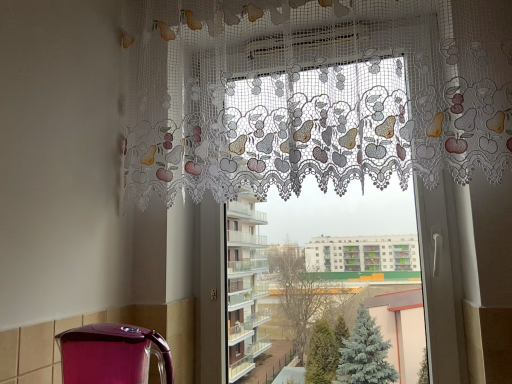
Question: Is point (100, 326) closer or farther from the camera than point (377, 129)?

Choices:
 (A) closer
 (B) farther

Answer: (A)

Question: Based on their positions, is shiny purple kettle at lower left located to the left or right of white lace curtain at upper center?

Choices:
 (A) right
 (B) left

Answer: (B)

Question: Which is farther from the lace fabric curtain at upper center?

Choices:
 (A) shiny purple kettle at lower left
 (B) white lace curtain at upper center

Answer: (A)

Question: Estimate the real-world distances between objects in this image. Which object is closer to the lace fabric curtain at upper center?

Choices:
 (A) shiny purple kettle at lower left
 (B) white lace curtain at upper center

Answer: (B)